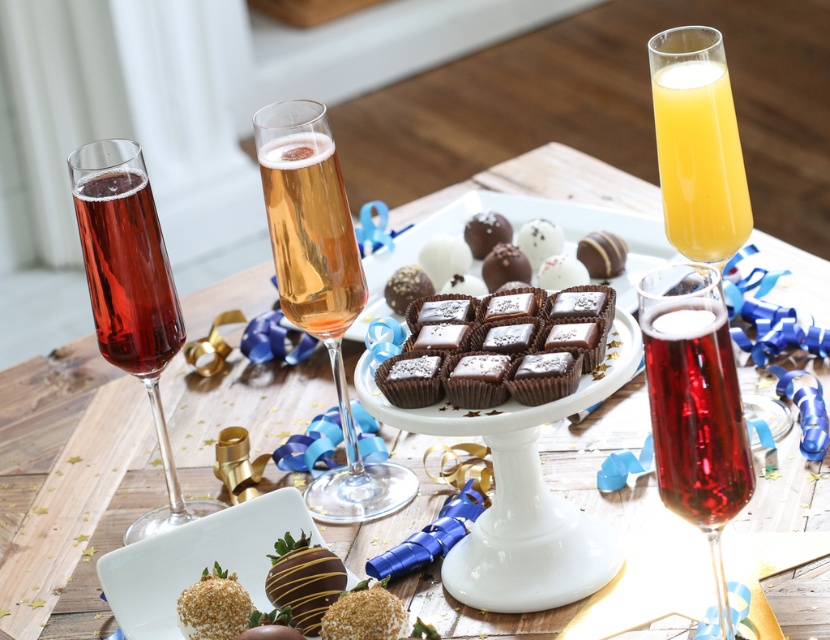
You need to place a narrow decorative ribbon around the matte glass at left and the golden bubbly champagne at center. Which one requires a longer ribbon to fully wrap around its circumference?

The golden bubbly champagne at center requires a longer ribbon because it is thicker than the matte glass at left, resulting in a larger circumference.

From the picture: You are a bartender preparing drinks for a party. You need to choose a glass that is taller to serve a sparkling cocktail. Which one should you pick between the translucent glass flute at upper right and the matte glass at left?

The translucent glass flute at upper right is taller than the matte glass at left, so you should choose the translucent glass flute at upper right to serve the sparkling cocktail.